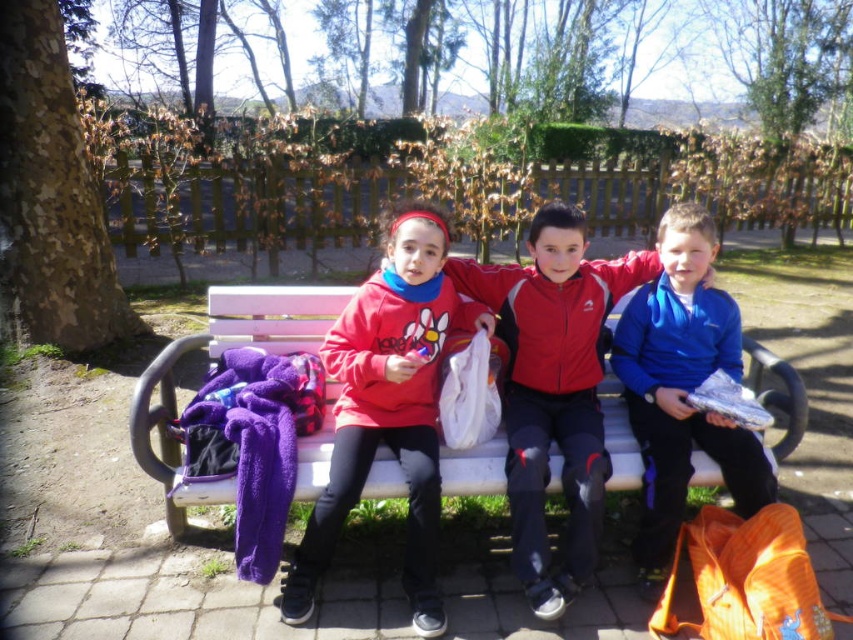
Question: Which point is farther from the camera taking this photo?

Choices:
 (A) tap(527, 588)
 (B) tap(321, 458)
 (C) tap(409, 554)

Answer: (B)

Question: Based on their relative distances, which object is farther from the red matte jacket at center?

Choices:
 (A) white wooden bench at center
 (B) matte red hoodie at center

Answer: (B)

Question: Observing the image, what is the correct spatial positioning of blue fleece jacket at right in reference to white wooden bench at center?

Choices:
 (A) left
 (B) right

Answer: (B)

Question: Does matte red hoodie at center lie behind white wooden bench at center?

Choices:
 (A) yes
 (B) no

Answer: (B)

Question: From the image, what is the correct spatial relationship of red matte jacket at center in relation to white wooden bench at center?

Choices:
 (A) below
 (B) above

Answer: (B)

Question: Which point is closer to the camera taking this photo?

Choices:
 (A) (612, 472)
 (B) (550, 246)
 (C) (427, 284)
 (D) (704, 250)

Answer: (A)